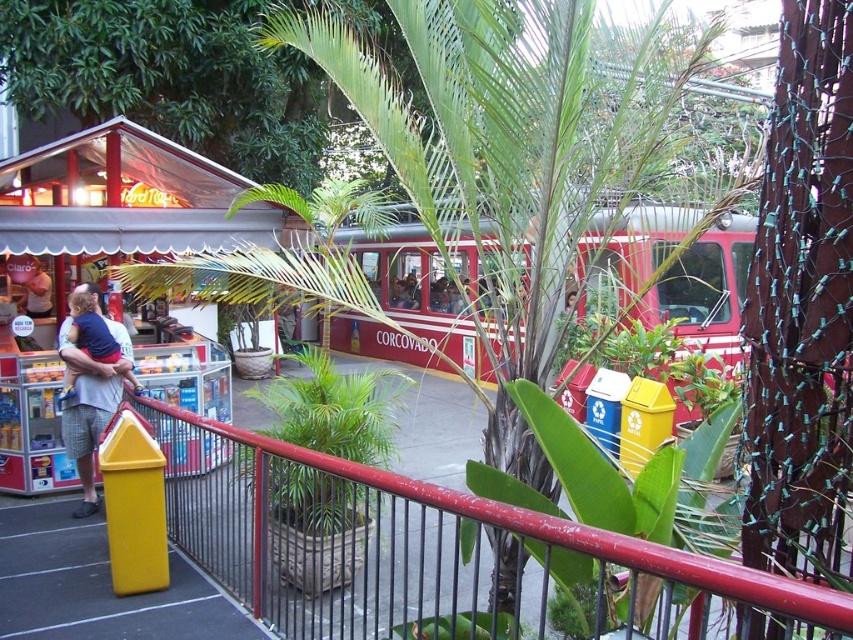
Question: Is red corrugated metal train car at center to the right of matte white shirt at left from the viewer's perspective?

Choices:
 (A) no
 (B) yes

Answer: (B)

Question: Among these objects, which one is farthest from the camera?

Choices:
 (A) metallic red railing at center
 (B) red corrugated metal train car at center
 (C) matte white shirt at left
 (D) matte blue shirt at left

Answer: (D)

Question: Is metallic red railing at center thinner than matte white shirt at left?

Choices:
 (A) no
 (B) yes

Answer: (A)

Question: Which object is farther from the camera taking this photo?

Choices:
 (A) red corrugated metal train car at center
 (B) matte white shirt at left
 (C) matte blue shirt at left

Answer: (C)

Question: Can you confirm if metallic red railing at center is positioned to the right of matte blue shirt at left?

Choices:
 (A) no
 (B) yes

Answer: (B)

Question: Which point is closer to the camera taking this photo?

Choices:
 (A) (125, 348)
 (B) (749, 252)

Answer: (A)